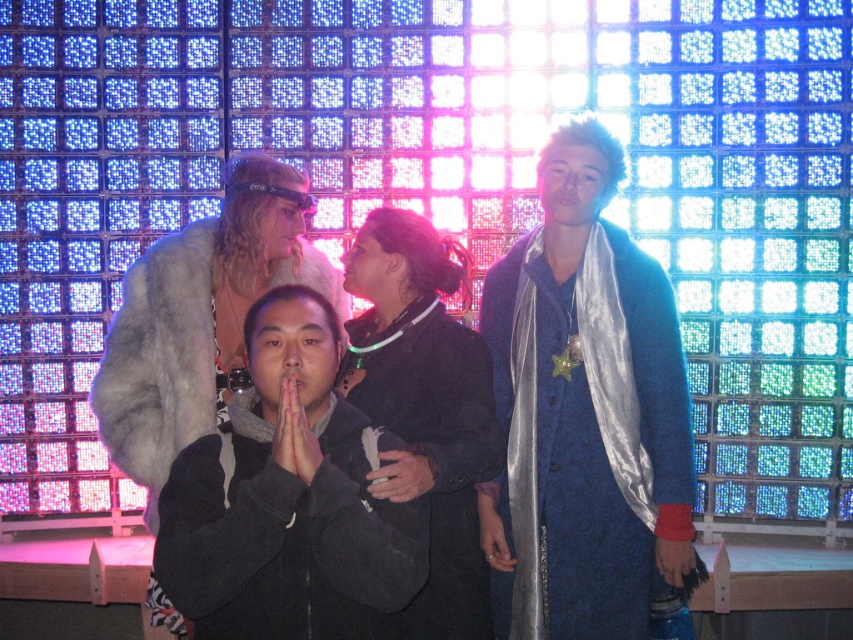
Question: Is black fuzzy coat at center bigger than dark gray fabric hand at center?

Choices:
 (A) no
 (B) yes

Answer: (B)

Question: Which point is farther to the camera?

Choices:
 (A) (138, 323)
 (B) (195, 472)
 (C) (280, 394)

Answer: (A)

Question: Which of these objects is positioned closest to the silver metallic ring at center?

Choices:
 (A) fuzzy white fur coat at center
 (B) black fuzzy coat at center

Answer: (B)

Question: Observing the image, what is the correct spatial positioning of black fabric coat at center in reference to silver metallic ring at center?

Choices:
 (A) left
 (B) right

Answer: (A)

Question: Which of the following is the closest to the observer?

Choices:
 (A) (428, 474)
 (B) (252, 374)
 (C) (659, 272)

Answer: (A)

Question: Does silky blue coat at center have a lesser width compared to fuzzy white fur coat at center?

Choices:
 (A) no
 (B) yes

Answer: (B)